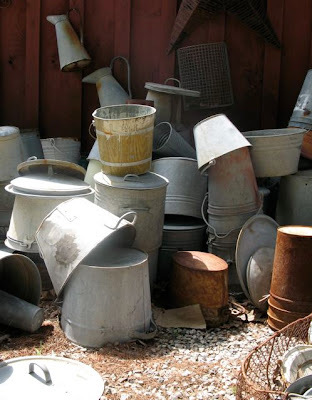
Identify the location of wooden bucket. (124, 155).